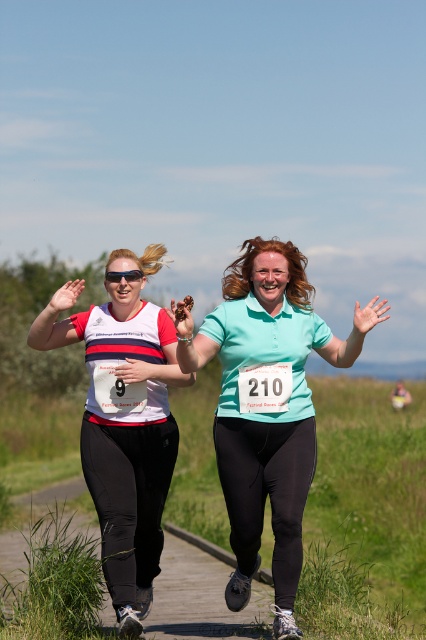
Who is more distant from viewer, (253, 326) or (121, 506)?

The point (253, 326) is more distant.

The image size is (426, 640). Find the location of `teal matte shirt at center`. teal matte shirt at center is located at coordinates (267, 410).

Who is higher up, white matte shirt at center or black plastic goggles at center?

black plastic goggles at center is above.

From the picture: Does white matte shirt at center have a smaller size compared to black plastic goggles at center?

Actually, white matte shirt at center might be larger than black plastic goggles at center.

You are a GUI agent. You are given a task and a screenshot of the screen. Output one action in this format:
    pyautogui.click(x=<x>, y=<y>)
    Task: Click on the white matte shirt at center
    The height and width of the screenshot is (640, 426).
    Given the screenshot: What is the action you would take?
    pyautogui.click(x=123, y=422)

Can you confirm if teal matte shirt at center is bigger than black plastic goggles at center?

Correct, teal matte shirt at center is larger in size than black plastic goggles at center.

Does point (287, 445) come farther from viewer compared to point (135, 273)?

No.

Which is in front, point (230, 493) or point (131, 275)?

Point (230, 493) is in front.

What are the coordinates of `teal matte shirt at center` in the screenshot? It's located at (267, 410).